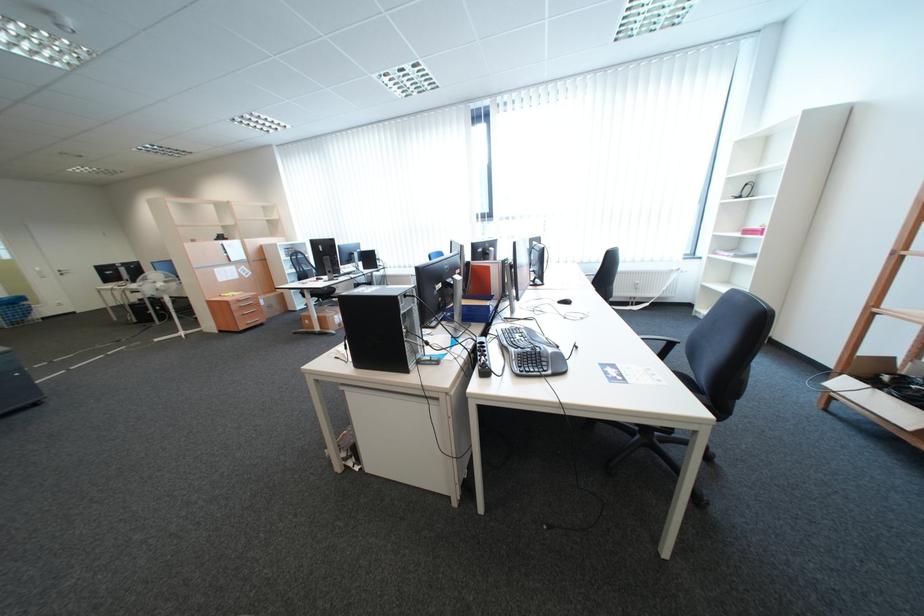
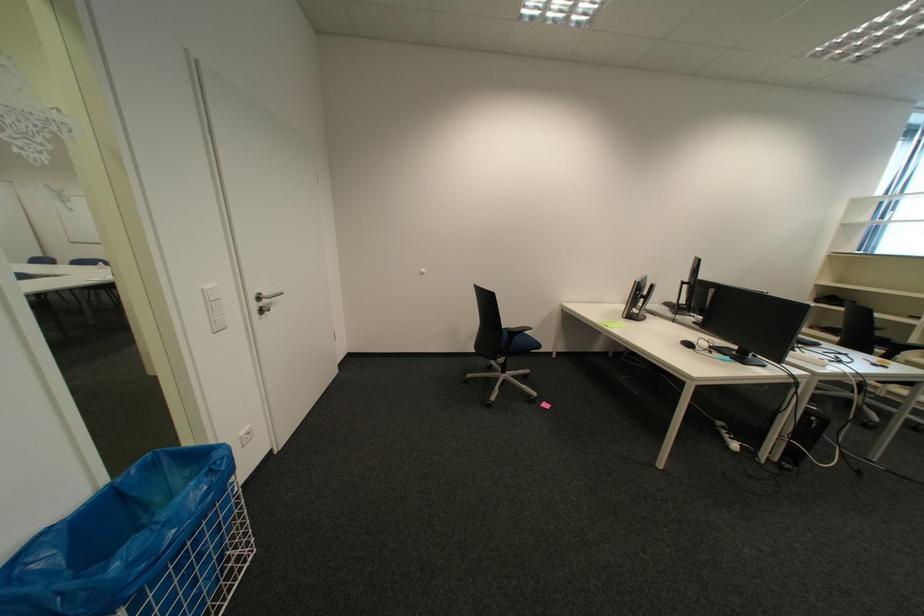
Locate, in the second image, the point that corresponds to point (70, 274) in the first image.

(266, 307)